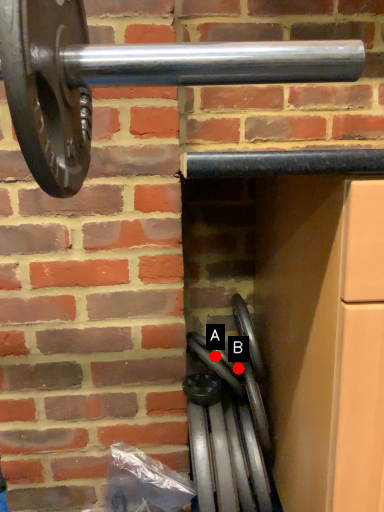
Question: Two points are circled on the image, labeled by A and B beside each circle. Which of the following is the closest to the observer?

Choices:
 (A) A is closer
 (B) B is closer

Answer: (A)